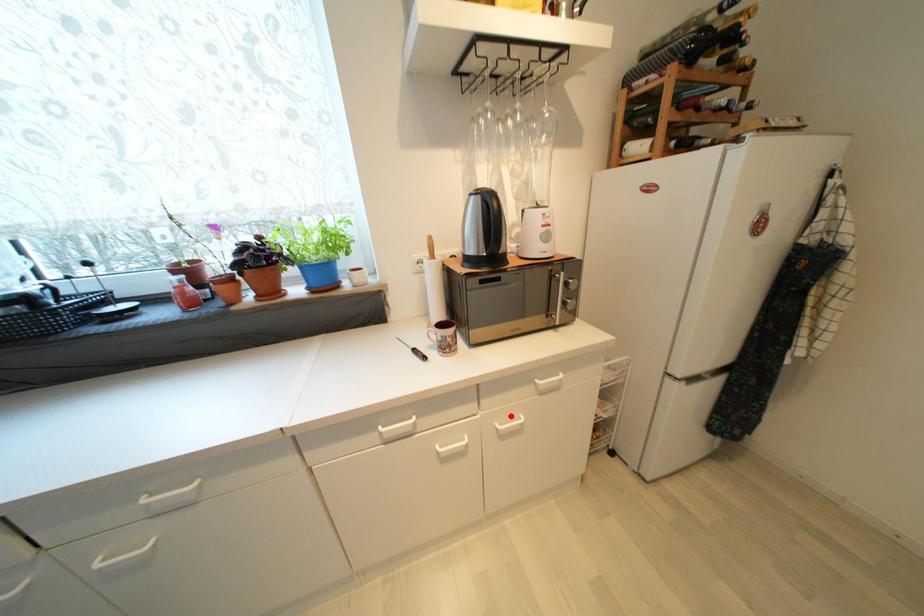
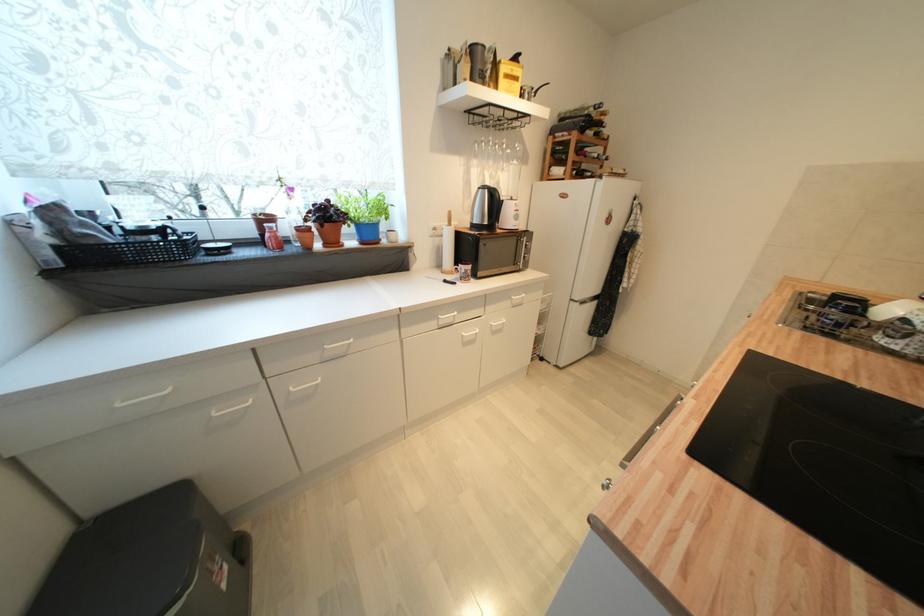
Locate, in the second image, the point that corresponds to the highlighted location in the first image.

(502, 318)